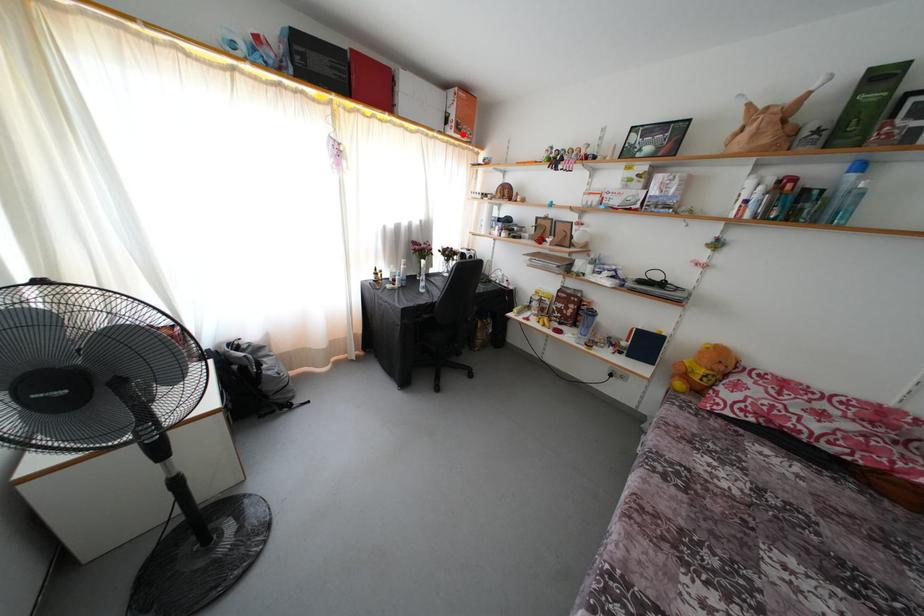
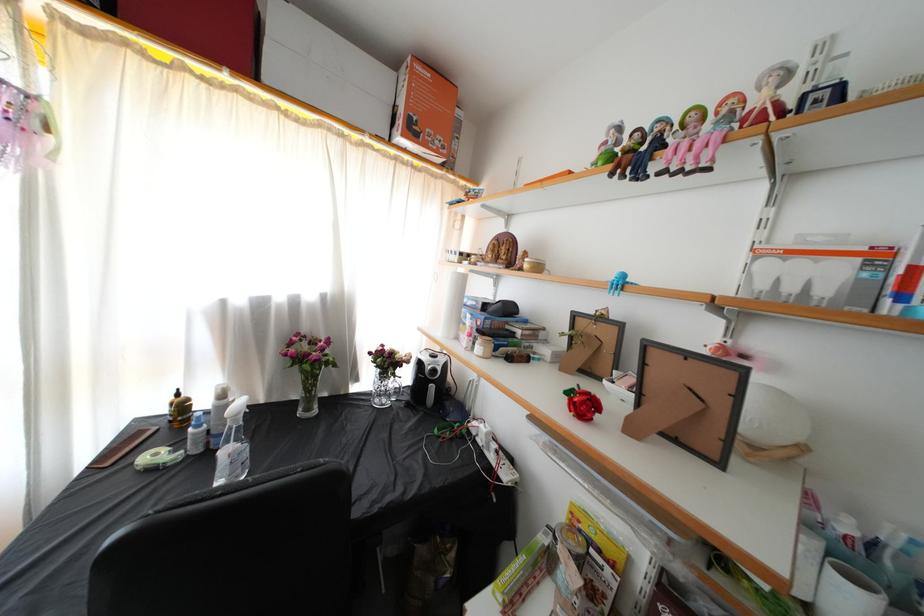
In the second image, find the point that corresponds to the highlighted location in the first image.

(418, 137)